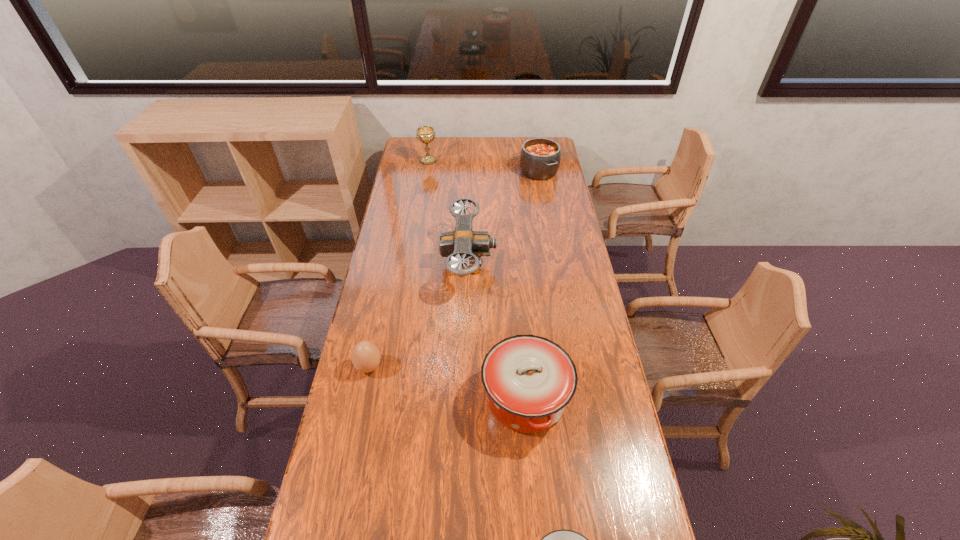
You are a GUI agent. You are given a task and a screenshot of the screen. Output one action in this format:
    pyautogui.click(x=<x>, y=<y>)
    Task: Click on the blank area located on the front of the boiled egg
    This screenshot has width=960, height=540.
    Given the screenshot: What is the action you would take?
    pyautogui.click(x=362, y=399)

Identify the location of chalice situated at the far edge. (426, 134).

Where is `casserole positioned at the far edge`? Image resolution: width=960 pixels, height=540 pixels. casserole positioned at the far edge is located at coordinates (540, 158).

Find the location of a particular element. The width and height of the screenshot is (960, 540). chalice at the left edge is located at coordinates (426, 134).

I want to click on boiled egg that is at the left edge, so click(x=365, y=356).

I want to click on object located in the far left corner section of the desktop, so click(x=426, y=134).

Locate an element on the screen. Image resolution: width=960 pixels, height=540 pixels. object present at the far right corner is located at coordinates (540, 158).

At what (x,y) coordinates should I click in order to perform the action: click on free space at the far edge of the desktop. Please return your answer as a coordinate pair (x, y). Looking at the image, I should click on (456, 150).

Locate an element on the screen. The image size is (960, 540). free space at the left edge of the desktop is located at coordinates [x=387, y=356].

In the image, there is a desktop. Where is `free space at the right edge`? free space at the right edge is located at coordinates (634, 491).